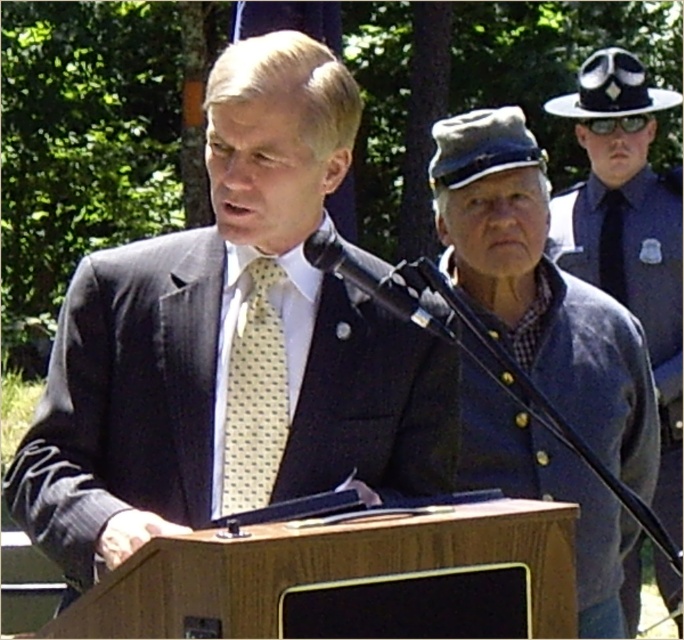
Question: Is blue woolen jacket at right above black silk tie at center?

Choices:
 (A) yes
 (B) no

Answer: (B)

Question: Among these points, which one is farthest from the camera?

Choices:
 (A) (603, 237)
 (B) (274, 364)

Answer: (A)

Question: Does wooden podium at center appear on the right side of yellow dotted tie at center?

Choices:
 (A) no
 (B) yes

Answer: (B)

Question: Observing the image, what is the correct spatial positioning of matte black suit at center in reference to black plastic microphone at center?

Choices:
 (A) above
 (B) below

Answer: (B)

Question: Among these points, which one is farthest from the camera?

Choices:
 (A) (196, 264)
 (B) (306, 248)
 (C) (633, 605)
 (D) (252, 392)

Answer: (C)

Question: Which point appears closest to the camera in this image?

Choices:
 (A) (443, 257)
 (B) (603, 209)

Answer: (A)